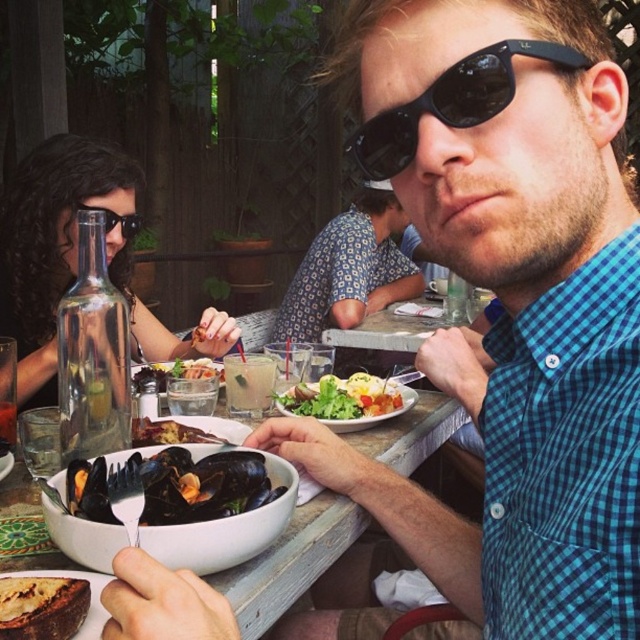
You are a waiter at the restaurant and need to place a new drink order on the table. The customer has specified that the drink should be placed to the left of the shiny black mussels at center. Where should you place the drink in relation to the white ceramic bowl at center?

The white ceramic bowl at center is on the right side of the shiny black mussels at center, so the drink should be placed to the left of the shiny black mussels at center, which would be the opposite side of the white ceramic bowl at center.

You are a photographer trying to capture the man eating mussels. You have a camera and need to place it so that it is exactly 1.14 meters away from the matte black sunglasses at upper left. Where should you position the camera?

You should position the camera exactly 1.14 meters away from the matte black sunglasses at upper left, as the distance between them is already specified to be 1.14 meters.

You are a waiter at the outdoor dining area. You need to place a tall candle holder on the table. Which bowl, the white ceramic bowl at center or the smooth glass bowl at center, would you avoid placing the candle holder next to to prevent it from being too tall?

You should avoid placing the candle holder next to the white ceramic bowl at center because it has a greater height compared to the smooth glass bowl at center, which could make the total height too tall.